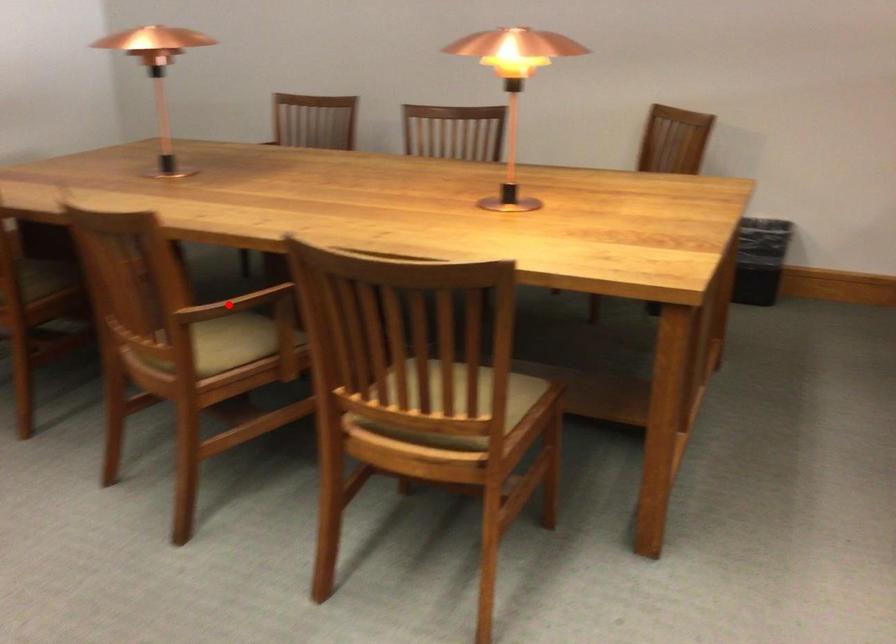
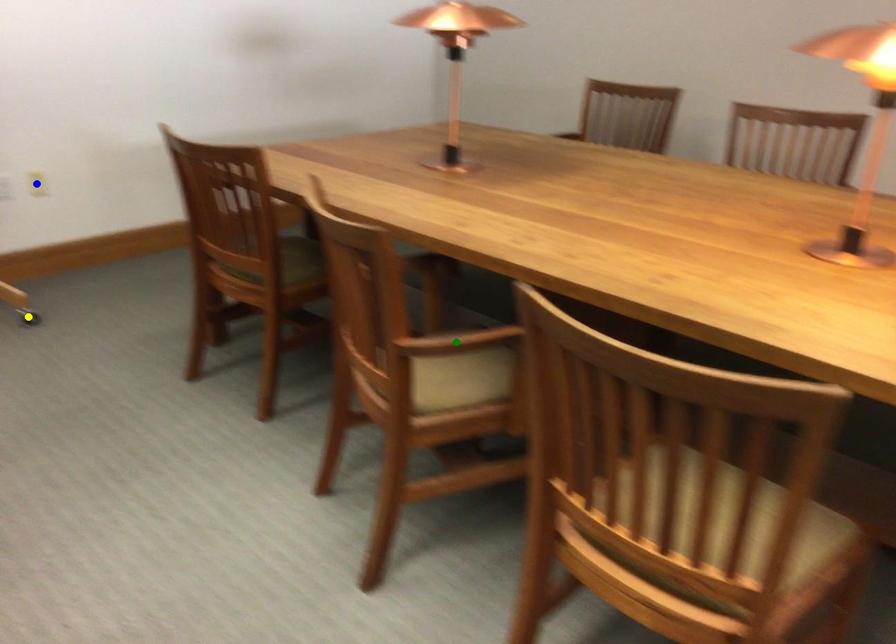
Question: I am providing you with two images of the same scene from different viewpoints. A red point is marked on the first image. You are given multiple points on the second image. Which spot in image 2 lines up with the point in image 1?

Choices:
 (A) green point
 (B) blue point
 (C) yellow point

Answer: (A)